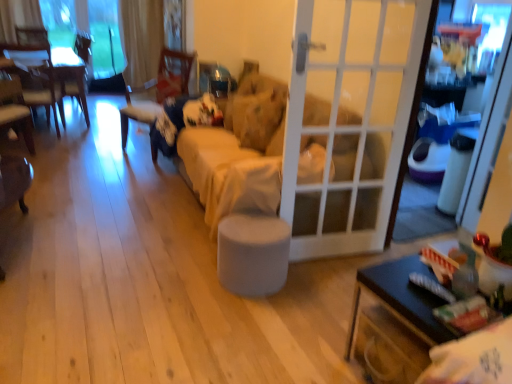
The height and width of the screenshot is (384, 512). Describe the element at coordinates (158, 89) in the screenshot. I see `velvet dark blue chair at center, arranged as the second chair when viewed from the left` at that location.

Describe the element at coordinates (70, 74) in the screenshot. The height and width of the screenshot is (384, 512). I see `wooden table at left, which ranks as the 2th table in bottom-to-top order` at that location.

Measure the distance between beige fabric couch at center and camera.

A distance of 2.54 meters exists between beige fabric couch at center and camera.

Measure the distance between point [3,83] and camera.

The distance of point [3,83] from camera is 13.19 feet.

The height and width of the screenshot is (384, 512). Describe the element at coordinates (16, 110) in the screenshot. I see `wooden chair at left, which is the 2th chair in right-to-left order` at that location.

How much space does black glossy table at lower right, arranged as the second table when viewed from the top, occupy horizontally?

It is 23.15 inches.

Locate an element on the screen. This screenshot has width=512, height=384. velvet dark blue chair at center, arranged as the second chair when viewed from the left is located at coordinates (158, 89).

In order to click on studio couch in front of the wooden table at left, arranged as the first table when viewed from the left in this screenshot , I will do `click(267, 111)`.

Can you tell me how much wooden table at left, which ranks as the 2th table in bottom-to-top order, and beige fabric couch at center differ in facing direction?

wooden table at left, which ranks as the 2th table in bottom-to-top order, and beige fabric couch at center are facing 0.138 degrees away from each other.

Choose the correct answer: Is wooden table at left, arranged as the first table when viewed from the left, inside beige fabric couch at center or outside it?

wooden table at left, arranged as the first table when viewed from the left, exists outside the volume of beige fabric couch at center.

Is wooden table at left, which appears as the 2th table when viewed from the right, not near beige fabric couch at center?

Indeed, wooden table at left, which appears as the 2th table when viewed from the right, is not near beige fabric couch at center.

At what (x,y) coordinates should I click in order to perform the action: click on door that appears below the beige fabric couch at center (from the image's perspective). Please return your answer as a coordinate pair (x, y). Looking at the image, I should click on (350, 126).

Is beige fabric couch at center further to camera compared to white glass door at center?

Yes, beige fabric couch at center is further from the camera.

Is white glass door at center at the back of beige fabric couch at center?

beige fabric couch at center is not turned away from white glass door at center.

From a real-world perspective, which object rests below the other?

beige fabric couch at center is physically lower.

Measure the distance from black glossy table at lower right, arranged as the second table when viewed from the top, to beige fabric couch at center.

They are 3.94 feet apart.

From a real-world perspective, which object rests below the other?

black glossy table at lower right, the 1th table in the right-to-left sequence, is physically lower.

From the picture: Is black glossy table at lower right, arranged as the second table when viewed from the top, not within beige fabric couch at center?

black glossy table at lower right, arranged as the second table when viewed from the top, is positioned outside beige fabric couch at center.

Considering the points (416, 267) and (328, 193), which point is behind, point (416, 267) or point (328, 193)?

The point (328, 193) is more distant.

Considering the positions of objects black glossy table at lower right, the 1th table in the right-to-left sequence, and white glass door at center in the image provided, who is in front, black glossy table at lower right, the 1th table in the right-to-left sequence, or white glass door at center?

black glossy table at lower right, the 1th table in the right-to-left sequence.

Is black glossy table at lower right, positioned as the second table in back-to-front order, looking in the opposite direction of white glass door at center?

No, black glossy table at lower right, positioned as the second table in back-to-front order,'s orientation is not away from white glass door at center.

Locate an element on the screen. door that is behind the black glossy table at lower right, the 1th table from the bottom is located at coordinates (350, 126).

Are black glossy table at lower right, positioned as the second table in back-to-front order, and white glass door at center making contact?

No, black glossy table at lower right, positioned as the second table in back-to-front order, is not touching white glass door at center.

Is gray fabric stool at center closer to the viewer compared to white glass door at center?

No, gray fabric stool at center is behind white glass door at center.

From a real-world perspective, is gray fabric stool at center below white glass door at center?

Indeed, from a real-world perspective, gray fabric stool at center is positioned beneath white glass door at center.

Can you see gray fabric stool at center touching white glass door at center?

gray fabric stool at center is not next to white glass door at center, and they're not touching.

In the image, there is a white glass door at center. Find the location of `stool below it (from a real-world perspective)`. stool below it (from a real-world perspective) is located at coordinates (253, 254).

Is beige fabric couch at center spatially inside black glossy table at lower right, positioned as the second table in back-to-front order, or outside of it?

beige fabric couch at center is outside black glossy table at lower right, positioned as the second table in back-to-front order.

Considering the sizes of beige fabric couch at center and black glossy table at lower right, arranged as the 1th table when viewed from the front, in the image, is beige fabric couch at center wider or thinner than black glossy table at lower right, arranged as the 1th table when viewed from the front,?

Considering their sizes, beige fabric couch at center looks broader than black glossy table at lower right, arranged as the 1th table when viewed from the front.

Considering the positions of objects beige fabric couch at center and black glossy table at lower right, the 1th table from the bottom, in the image provided, who is more to the right, beige fabric couch at center or black glossy table at lower right, the 1th table from the bottom,?

black glossy table at lower right, the 1th table from the bottom, is more to the right.

Is point (313, 143) more distant than point (432, 336)?

Yes, it is behind point (432, 336).

From the picture: In the image, is wooden table at left, which ranks as the 2th table in bottom-to-top order, positioned in front of or behind velvet dark blue chair at center, the 1th chair positioned from the right?

Visually, wooden table at left, which ranks as the 2th table in bottom-to-top order, is located behind velvet dark blue chair at center, the 1th chair positioned from the right.

Is wooden table at left, acting as the first table starting from the back, aimed at velvet dark blue chair at center, the 1th chair positioned from the right?

No, wooden table at left, acting as the first table starting from the back, is not oriented towards velvet dark blue chair at center, the 1th chair positioned from the right.

Is wooden table at left, acting as the first table starting from the back, not near velvet dark blue chair at center, arranged as the second chair when viewed from the left?

Yes, wooden table at left, acting as the first table starting from the back, and velvet dark blue chair at center, arranged as the second chair when viewed from the left, are located far from each other.

Is wooden table at left, arranged as the first table when viewed from the left, positioned beyond the bounds of velvet dark blue chair at center, the 1th chair positioned from the right?

Yes.

Identify the location of studio couch below the wooden table at left, which appears as the 2th table when viewed from the right (from a real-world perspective). This screenshot has width=512, height=384. (267, 111).

At what (x,y) coordinates should I click in order to perform the action: click on studio couch that appears above the white glass door at center (from the image's perspective). Please return your answer as a coordinate pair (x, y). Looking at the image, I should click on (267, 111).

Estimate the real-world distances between objects in this image. Which object is further from velvet dark blue chair at center, arranged as the second chair when viewed from the left, black glossy table at lower right, arranged as the 1th table when viewed from the front, or transparent glass window at upper left?

black glossy table at lower right, arranged as the 1th table when viewed from the front, is further to velvet dark blue chair at center, arranged as the second chair when viewed from the left.

When comparing their distances from gray fabric stool at center, does beige fabric couch at center or wooden chair at left, which is the 2th chair in right-to-left order, seem further?

wooden chair at left, which is the 2th chair in right-to-left order, lies further to gray fabric stool at center than the other object.

Which object lies nearer to the anchor point gray fabric stool at center, wooden table at left, acting as the first table starting from the back, or transparent glass window at upper left?

wooden table at left, acting as the first table starting from the back.

When comparing their distances from black glossy table at lower right, the 1th table in the right-to-left sequence, does beige fabric couch at center or transparent glass window at upper left seem closer?

Among the two, beige fabric couch at center is located nearer to black glossy table at lower right, the 1th table in the right-to-left sequence.

Based on their spatial positions, is velvet dark blue chair at center, arranged as the second chair when viewed from the left, or wooden chair at left, the 1th chair in the left-to-right sequence, closer to white glass door at center?

velvet dark blue chair at center, arranged as the second chair when viewed from the left, lies closer to white glass door at center than the other object.

Estimate the real-world distances between objects in this image. Which object is closer to transparent glass window at upper left, gray fabric stool at center or velvet dark blue chair at center, the 1th chair positioned from the right?

velvet dark blue chair at center, the 1th chair positioned from the right, is positioned closer to the anchor transparent glass window at upper left.

Estimate the real-world distances between objects in this image. Which object is closer to wooden table at left, which appears as the 2th table when viewed from the right, gray fabric stool at center or white glass door at center?

white glass door at center lies closer to wooden table at left, which appears as the 2th table when viewed from the right, than the other object.

Looking at the image, which one is located further to wooden table at left, which ranks as the 2th table in bottom-to-top order, white glass door at center or wooden chair at left, the 1th chair in the left-to-right sequence?

white glass door at center.

At what (x,y) coordinates should I click in order to perform the action: click on studio couch between white glass door at center and wooden table at left, acting as the first table starting from the back, from front to back. Please return your answer as a coordinate pair (x, y). This screenshot has height=384, width=512. Looking at the image, I should click on (267, 111).

Where is `stool between white glass door at center and transparent glass window at upper left along the z-axis`? Image resolution: width=512 pixels, height=384 pixels. stool between white glass door at center and transparent glass window at upper left along the z-axis is located at coordinates (253, 254).

Find the location of a particular element. The image size is (512, 384). chair between wooden chair at left, which is the 2th chair in right-to-left order, and black glossy table at lower right, which is the 2th table in left-to-right order, in the horizontal direction is located at coordinates (158, 89).

The width and height of the screenshot is (512, 384). In order to click on studio couch positioned between black glossy table at lower right, which is the 2th table in left-to-right order, and transparent glass window at upper left from near to far in this screenshot , I will do [267, 111].